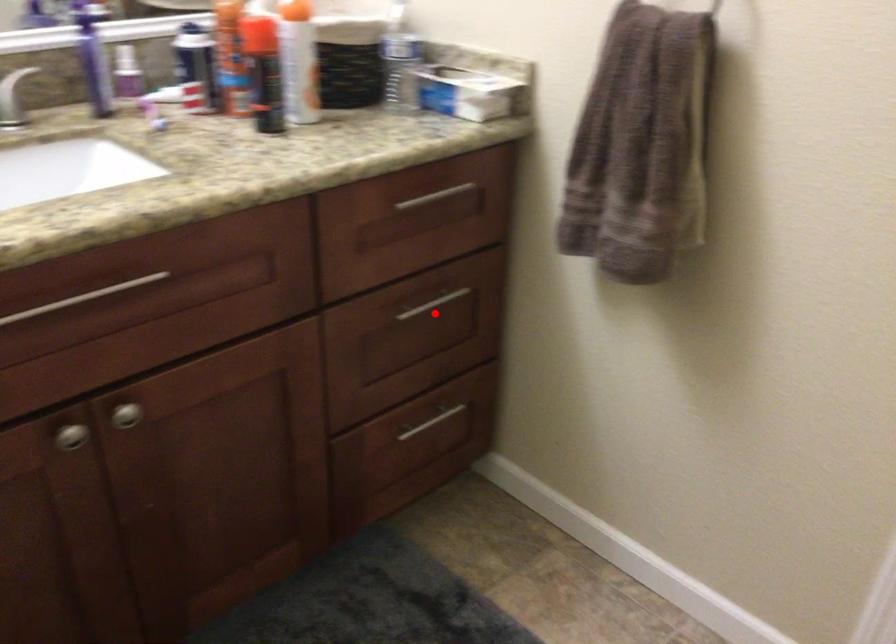
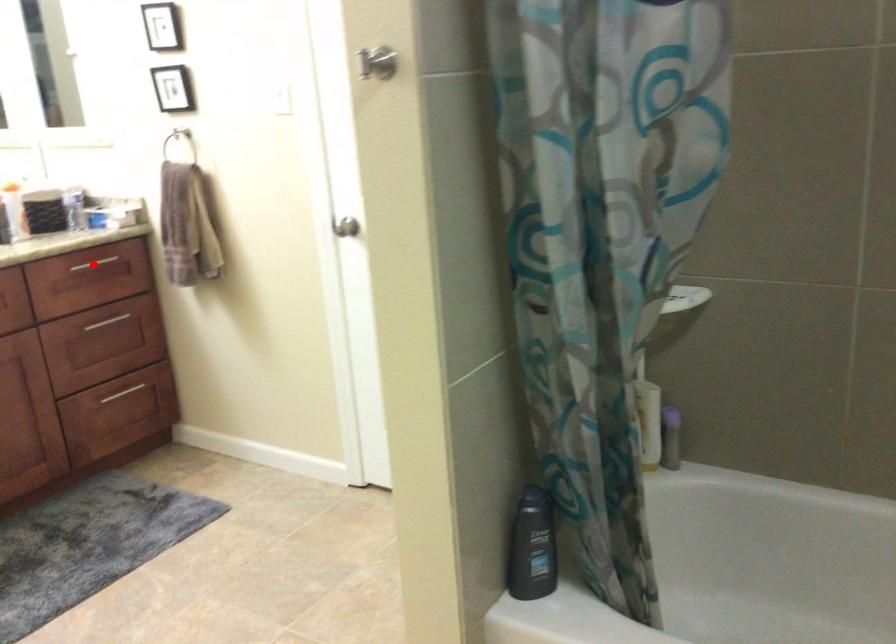
Looking at this image, I am providing you with two images of the same scene from different viewpoints. A red point is marked on the first image and another point is marked on the second image. Is the red point in image1 aligned with the point shown in image2?

No